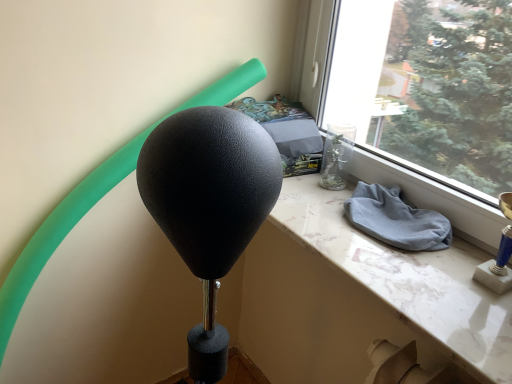
Question: From their relative heights in the image, would you say white marble table at center is taller or shorter than gray cotton cloth at window sill?

Choices:
 (A) short
 (B) tall

Answer: (A)

Question: Is white marble table at center wider or thinner than gray cotton cloth at window sill?

Choices:
 (A) wide
 (B) thin

Answer: (A)

Question: From the image's perspective, is white marble table at center above or below gray cotton cloth at window sill?

Choices:
 (A) above
 (B) below

Answer: (B)

Question: In the image, is gray cotton cloth at window sill on the left side or the right side of white marble table at center?

Choices:
 (A) right
 (B) left

Answer: (A)

Question: From a real-world perspective, is gray cotton cloth at window sill above or below white marble table at center?

Choices:
 (A) above
 (B) below

Answer: (A)

Question: Considering the positions of gray cotton cloth at window sill and white marble table at center in the image, is gray cotton cloth at window sill taller or shorter than white marble table at center?

Choices:
 (A) short
 (B) tall

Answer: (B)

Question: Is gray cotton cloth at window sill inside or outside of white marble table at center?

Choices:
 (A) inside
 (B) outside

Answer: (B)